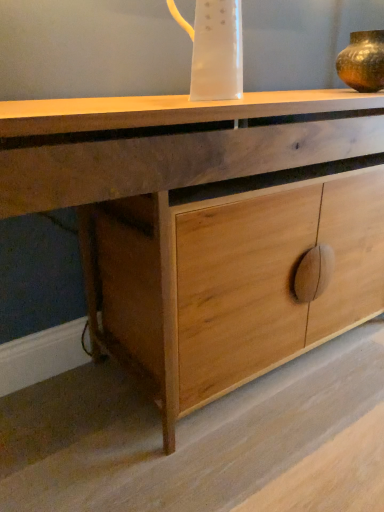
Question: Should I look upward or downward to see transparent plastic jug at upper center?

Choices:
 (A) down
 (B) up

Answer: (B)

Question: Does transparent plastic jug at upper center have a lesser width compared to natural wood cabinet at center?

Choices:
 (A) yes
 (B) no

Answer: (A)

Question: From a real-world perspective, is transparent plastic jug at upper center over natural wood cabinet at center?

Choices:
 (A) yes
 (B) no

Answer: (A)

Question: Does transparent plastic jug at upper center have a smaller size compared to natural wood cabinet at center?

Choices:
 (A) yes
 (B) no

Answer: (A)

Question: Does transparent plastic jug at upper center lie behind natural wood cabinet at center?

Choices:
 (A) no
 (B) yes

Answer: (B)

Question: From the image's perspective, is transparent plastic jug at upper center located above natural wood cabinet at center?

Choices:
 (A) no
 (B) yes

Answer: (B)

Question: Is transparent plastic jug at upper center at the right side of natural wood cabinet at center?

Choices:
 (A) no
 (B) yes

Answer: (A)

Question: Is natural wood cabinet at center to the left of transparent plastic jug at upper center from the viewer's perspective?

Choices:
 (A) yes
 (B) no

Answer: (B)

Question: From a real-world perspective, is natural wood cabinet at center over transparent plastic jug at upper center?

Choices:
 (A) no
 (B) yes

Answer: (A)

Question: Is natural wood cabinet at center facing away from transparent plastic jug at upper center?

Choices:
 (A) no
 (B) yes

Answer: (A)

Question: Is natural wood cabinet at center to the right of transparent plastic jug at upper center from the viewer's perspective?

Choices:
 (A) yes
 (B) no

Answer: (A)

Question: Is the depth of natural wood cabinet at center less than that of transparent plastic jug at upper center?

Choices:
 (A) no
 (B) yes

Answer: (B)

Question: Can you confirm if natural wood cabinet at center is thinner than transparent plastic jug at upper center?

Choices:
 (A) no
 (B) yes

Answer: (A)

Question: From the image's perspective, is transparent plastic jug at upper center beneath gold metallic vase at upper right?

Choices:
 (A) no
 (B) yes

Answer: (B)